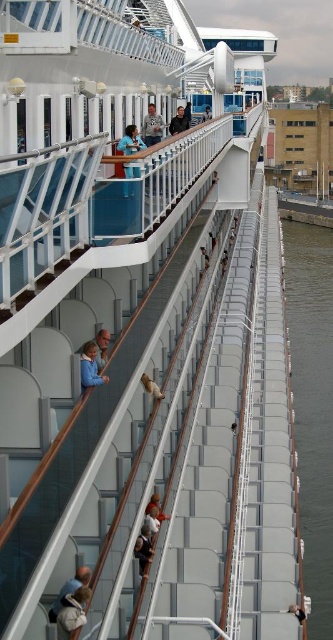
You are a photographer on the cruise ship deck. You want to take a photo of both the blue fabric shirt at upper center and the dark blue shirt at center. Which shirt should you position to the left side of your camera frame to include both in the photo?

The blue fabric shirt at upper center is already positioned to the left of the dark blue shirt at center, so you should place the blue fabric shirt at upper center on the left side of your camera frame to include both in the photo.

You are a photographer on the cruise ship deck, and you want to take a photo of both the blue fabric jacket at center and the light brown leather jacket at lower center. Which jacket should you focus on first if you want to include both in the frame without zooming in?

You should focus on the blue fabric jacket at center first because it is larger and will be easier to frame without needing to zoom in, allowing space for the smaller light brown leather jacket at lower center in the same shot.